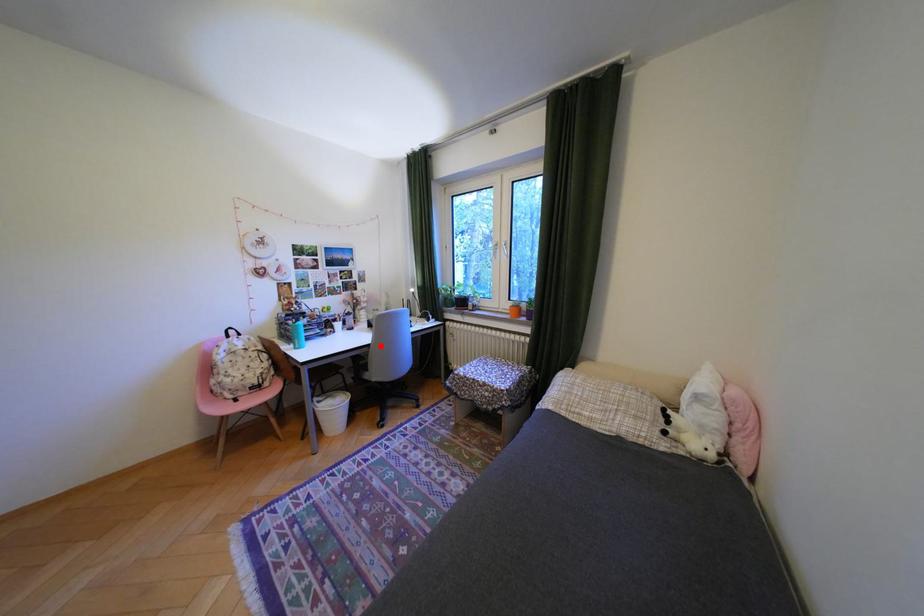
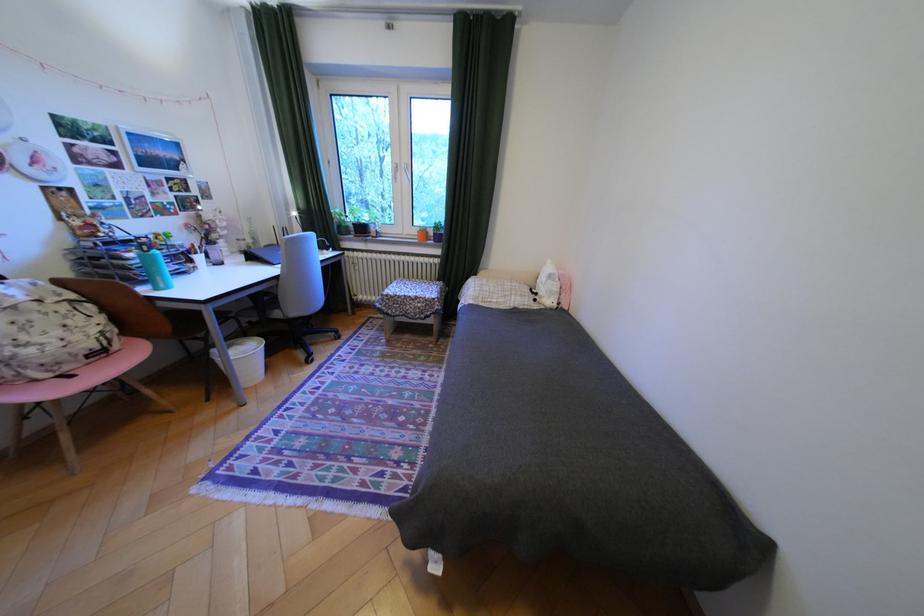
Question: I am providing you with two images of the same scene from different viewpoints. In image1, a red point is highlighted. Considering the same 3D point in image2, which of the following is correct?

Choices:
 (A) It is closer
 (B) It is farther

Answer: (A)